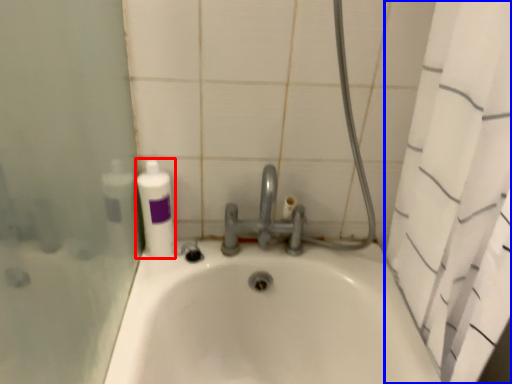
Question: Which point is further to the camera, cleaning product (highlighted by a red box) or shower curtain (highlighted by a blue box)?

Choices:
 (A) cleaning product
 (B) shower curtain

Answer: (A)